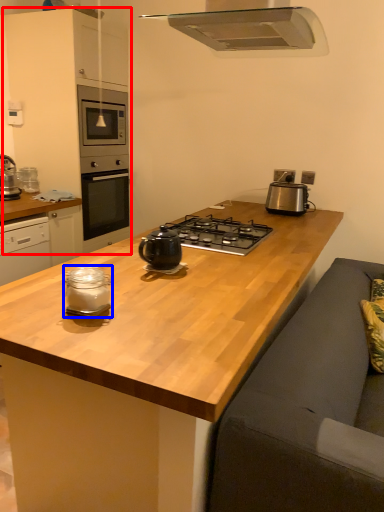
Question: Which object appears farthest to the camera in this image, cabinetry (highlighted by a red box) or kitchen appliance (highlighted by a blue box)?

Choices:
 (A) cabinetry
 (B) kitchen appliance

Answer: (A)